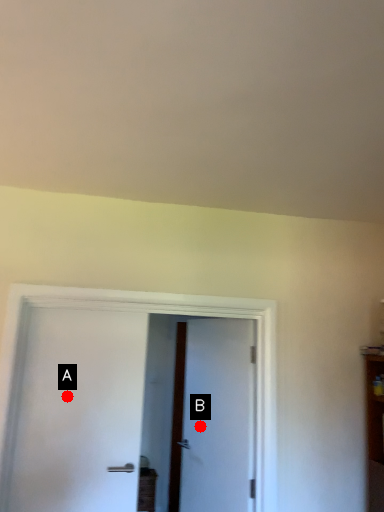
Question: Two points are circled on the image, labeled by A and B beside each circle. Which of the following is the closest to the observer?

Choices:
 (A) A is closer
 (B) B is closer

Answer: (A)